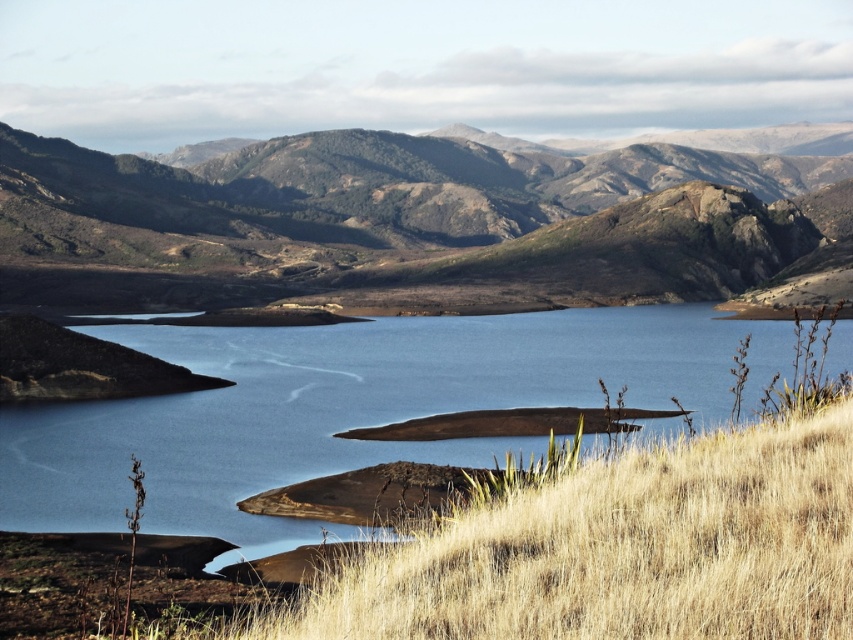
Which of these two, rugged brown mountain at center or blue water at center, stands shorter?

blue water at center

Locate an element on the screen. This screenshot has height=640, width=853. rugged brown mountain at center is located at coordinates (403, 224).